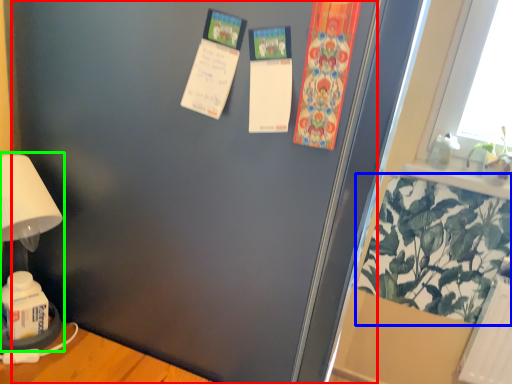
Question: Estimate the real-world distances between objects in this image. Which object is farther from screen door (highlighted by a red box), plant (highlighted by a blue box) or table lamp (highlighted by a green box)?

Choices:
 (A) plant
 (B) table lamp

Answer: (A)